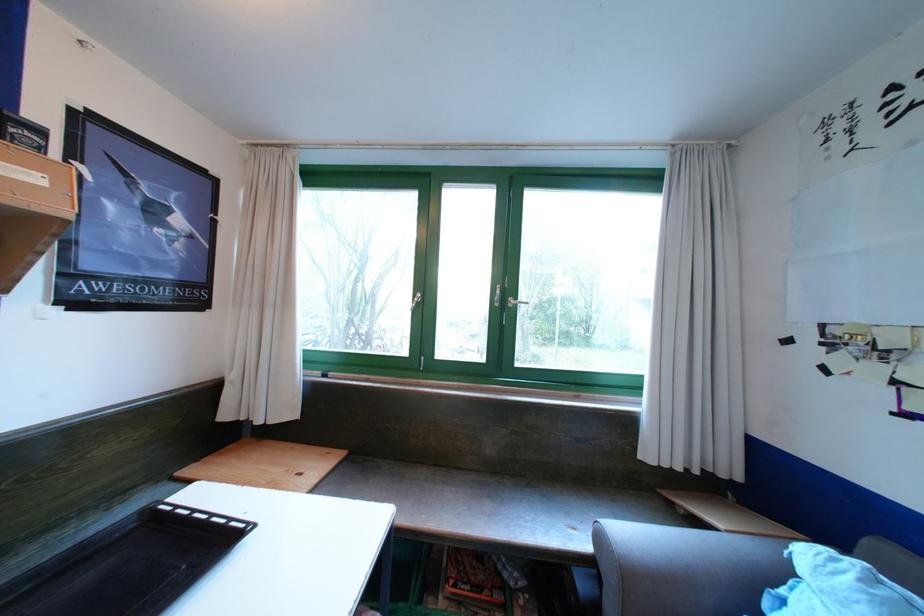
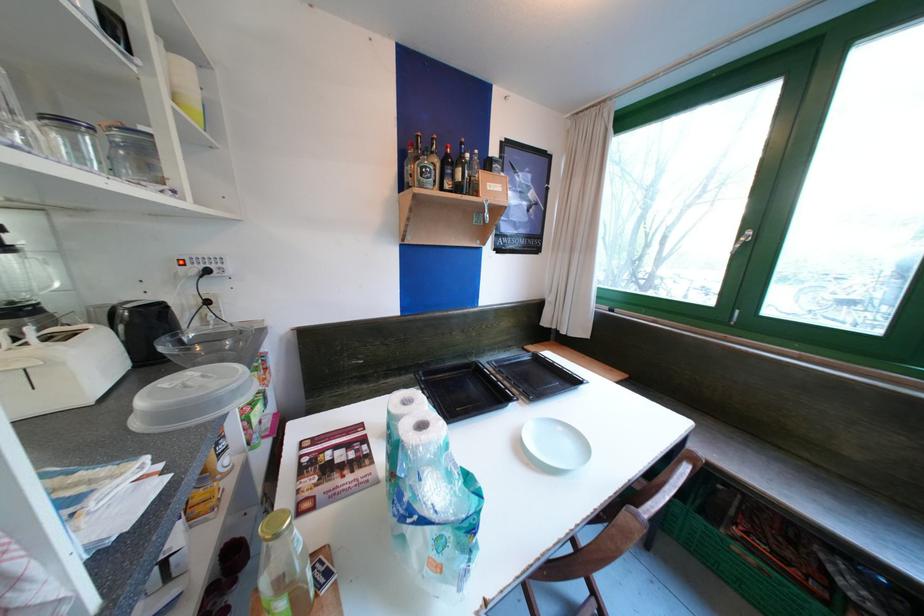
Find the pixel in the second image that matches (x=495, y=508) in the first image.

(835, 503)